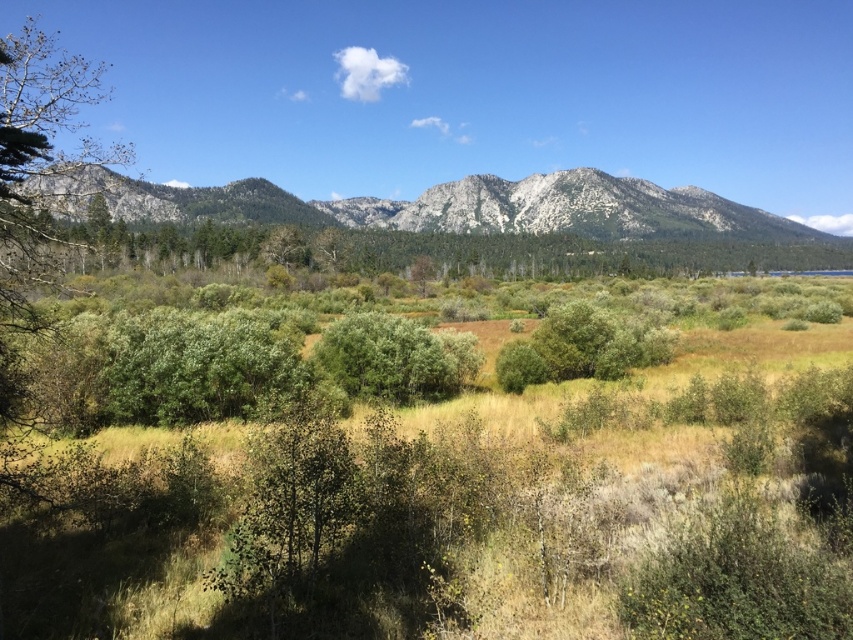
Based on the photo, you are a hiker standing at the edge of the grassy terrain. You see the gray rocky mountain range at center and the green leafy bush at center. Which object is closer to you?

The gray rocky mountain range at center is closer to you because it is positioned in front of the green leafy bush at center.

You are a hiker planning to take a photo of the gray rocky mountain range at center and the green leafy trees at center. Which object should you focus on first if you want to capture both in a single shot without adjusting your camera focus?

You should focus on the gray rocky mountain range at center first because it is positioned over the green leafy trees at center, meaning it is farther away. To capture both in focus, you need to set the focus on the farther object first.